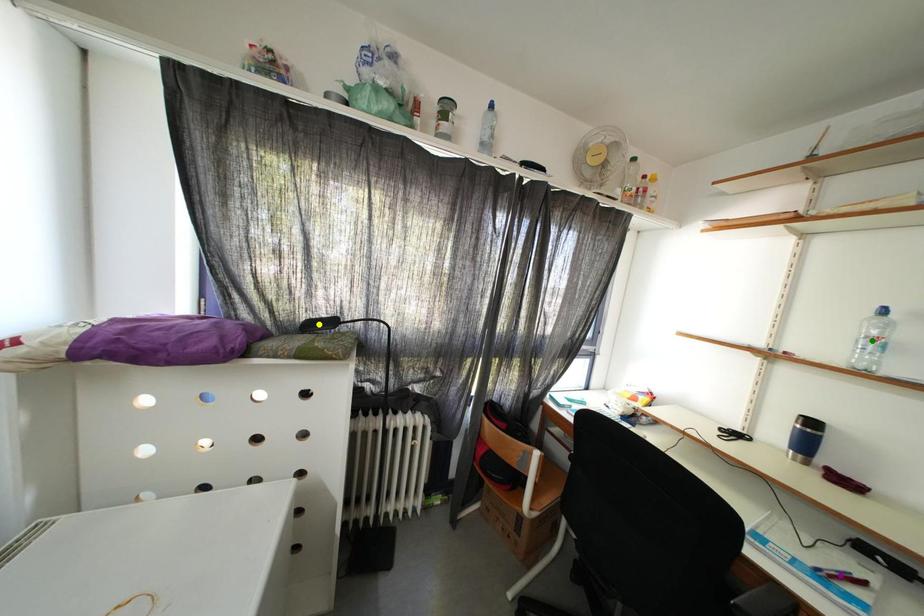
Order these from farthest to nearest:
- purple point
- green point
- yellow point

yellow point, green point, purple point